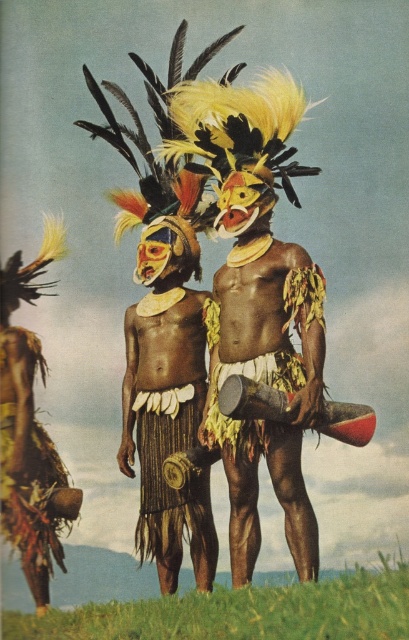
Question: Among these points, which one is nearest to the camera?

Choices:
 (A) (155, 483)
 (B) (177, 259)

Answer: (A)

Question: Considering the real-world distances, which object is closest to the matte brown skin at center?

Choices:
 (A) brown woven basket at lower left
 (B) brown woven skirt at center

Answer: (B)

Question: Does brown woven skirt at center appear over brown woven basket at lower left?

Choices:
 (A) yes
 (B) no

Answer: (A)

Question: In this image, where is matte brown skin at center located relative to brown woven basket at lower left?

Choices:
 (A) left
 (B) right

Answer: (B)

Question: Is brown woven skirt at center to the left of brown woven basket at lower left from the viewer's perspective?

Choices:
 (A) yes
 (B) no

Answer: (B)

Question: Which object is closer to the camera taking this photo?

Choices:
 (A) brown woven skirt at center
 (B) matte brown skin at center

Answer: (A)